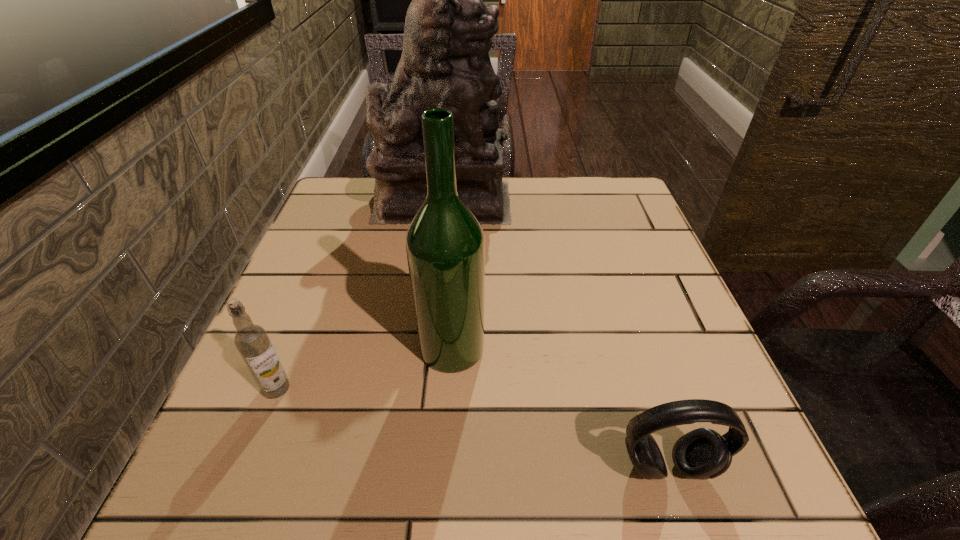
You are a GUI agent. You are given a task and a screenshot of the screen. Output one action in this format:
    pyautogui.click(x=<x>, y=<y>)
    Task: Click on the vacant space that satisfies the following two spatial constraints: 1. on the front-facing side of the alcohol; 2. on the right side of the sculpture
    This screenshot has width=960, height=540.
    Given the screenshot: What is the action you would take?
    pyautogui.click(x=426, y=348)

I want to click on vacant area in the image that satisfies the following two spatial constraints: 1. on the back side of the third nearest object; 2. on the front-facing side of the sculpture, so pos(461,200).